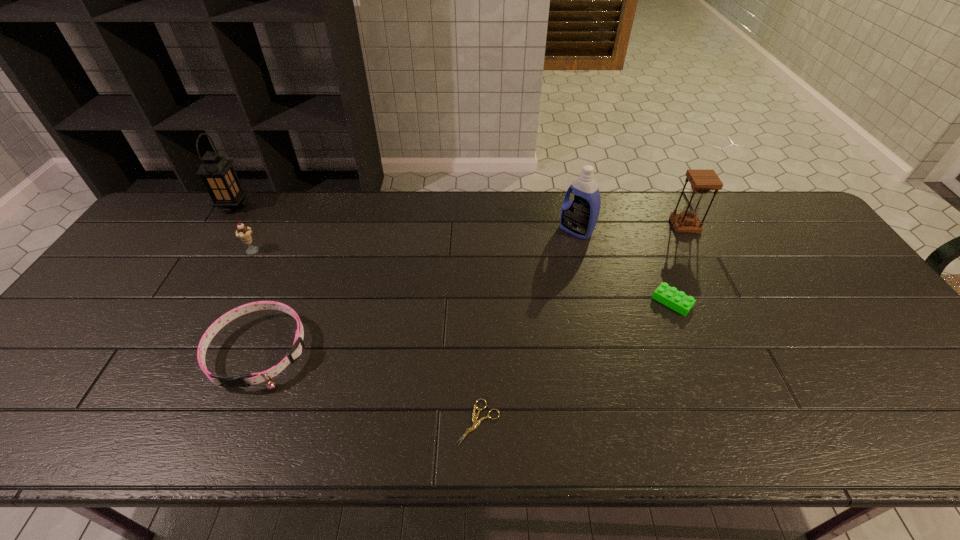
Locate an element on the screen. The width and height of the screenshot is (960, 540). free space that satisfies the following two spatial constraints: 1. on the back side of the third tallest object; 2. on the right side of the sixth object from left to right is located at coordinates (641, 226).

Locate an element on the screen. The image size is (960, 540). free location that satisfies the following two spatial constraints: 1. with the buckle on the dog collar; 2. on the right side of the shears is located at coordinates (230, 422).

Find the location of `vacant space that satisfies the following two spatial constraints: 1. with the buckle on the nearest object; 2. on the left side of the fifth tallest object`. vacant space that satisfies the following two spatial constraints: 1. with the buckle on the nearest object; 2. on the left side of the fifth tallest object is located at coordinates (230, 422).

Where is `free space that satisfies the following two spatial constraints: 1. on the front side of the farthest object; 2. on the left side of the third object from right to left`? Image resolution: width=960 pixels, height=540 pixels. free space that satisfies the following two spatial constraints: 1. on the front side of the farthest object; 2. on the left side of the third object from right to left is located at coordinates (218, 230).

Image resolution: width=960 pixels, height=540 pixels. In order to click on vacant area that satisfies the following two spatial constraints: 1. on the back side of the shears; 2. on the left side of the sixth tallest object in this screenshot , I will do tap(479, 302).